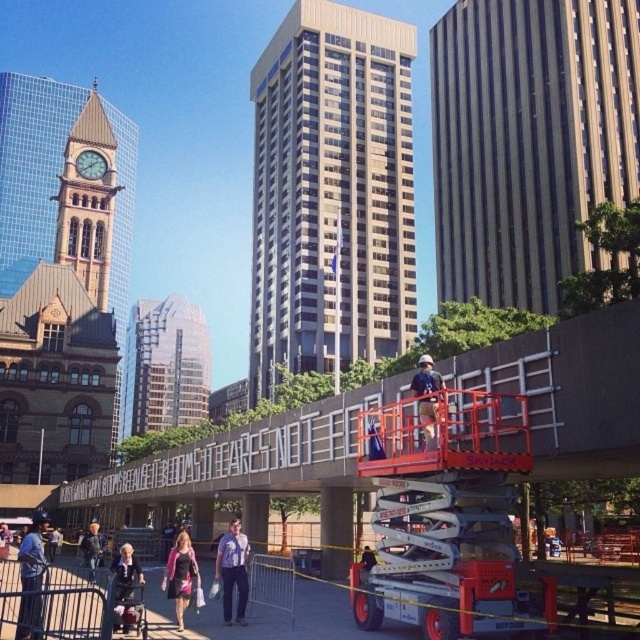
You are a delivery drone that needs to fly from the gold glass skyscraper at center to the metallic silver barrier at lower center. Based on the scene description, which direction should you fly to reach your destination?

The gold glass skyscraper at center is to the left of the metallic silver barrier at lower center, so you should fly to the right to reach the metallic silver barrier at lower center.

Consider the image. You are a city planner reviewing the urban layout. Based on the scene, can you identify the coordinates of the brown textured building at upper right?

The brown textured building at upper right is located at coordinates point [529,140].

From the picture: You are a delivery drone operator. Your drone needs to fly from the glassy reflective skyscraper at center to the metallic silver barrier at lower center. Based on the scene, which direction should you steer the drone to reach the barrier?

The glassy reflective skyscraper at center is to the left of metallic silver barrier at lower center, so you should steer the drone to the right to reach the barrier.